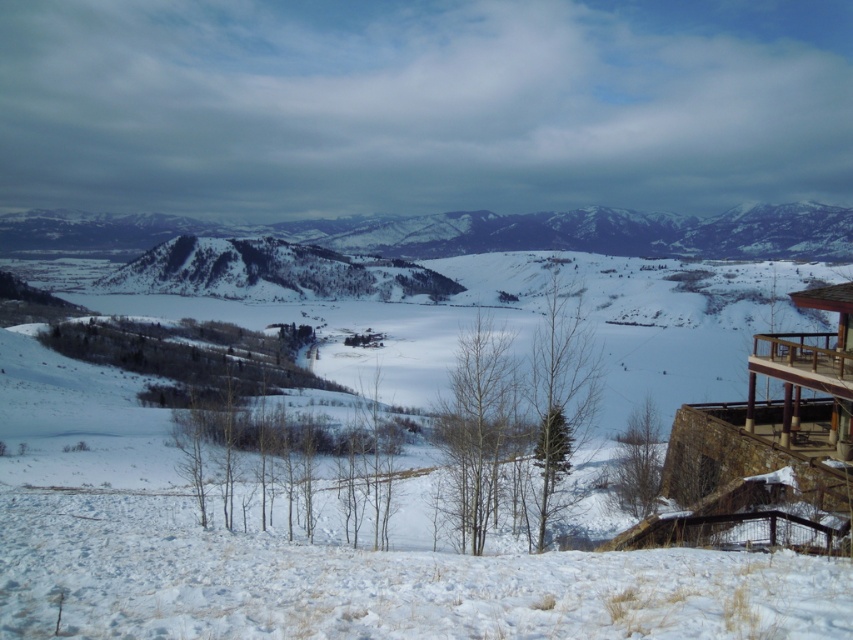
Does snowy textured mountain at center appear on the right side of brown wooden balcony at lower right?

Incorrect, snowy textured mountain at center is not on the right side of brown wooden balcony at lower right.

Does point (413, 256) lie behind point (836, 376)?

Yes.

Image resolution: width=853 pixels, height=640 pixels. Find the location of `snowy textured mountain at center`. snowy textured mountain at center is located at coordinates (467, 232).